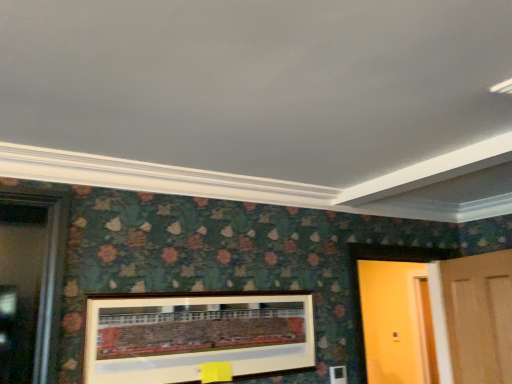
Image resolution: width=512 pixels, height=384 pixels. What do you see at coordinates (389, 261) in the screenshot?
I see `wooden door at right, the 2th door in the right-to-left sequence` at bounding box center [389, 261].

Describe the element at coordinates (196, 335) in the screenshot. I see `wooden picture frame at center` at that location.

At what (x,y) coordinates should I click in order to perform the action: click on wooden door at right, the 2th door in the right-to-left sequence. Please return your answer as a coordinate pair (x, y). The width and height of the screenshot is (512, 384). Looking at the image, I should click on (389, 261).

How many degrees apart are the facing directions of wooden door at right, which is the first door in right-to-left order, and wooden door at right, the 2th door in the right-to-left sequence?

wooden door at right, which is the first door in right-to-left order, and wooden door at right, the 2th door in the right-to-left sequence, are facing 110 degrees away from each other.

This screenshot has height=384, width=512. Find the location of `door in front of the wooden door at right, which is the first door in left-to-right order`. door in front of the wooden door at right, which is the first door in left-to-right order is located at coordinates (474, 317).

Who is taller, wooden door at right, the second door positioned from the left, or wooden door at right, which is the first door in left-to-right order?

wooden door at right, which is the first door in left-to-right order.

Which object is positioned more to the right, wooden door at right, which is the first door in right-to-left order, or wooden door at right, the 2th door in the right-to-left sequence?

wooden door at right, which is the first door in right-to-left order, is more to the right.

How much distance is there between wooden picture frame at center and wooden door at right, the 2th door in the right-to-left sequence?

The distance of wooden picture frame at center from wooden door at right, the 2th door in the right-to-left sequence, is 32.88 inches.

Is wooden picture frame at center positioned beyond the bounds of wooden door at right, which is the first door in left-to-right order?

wooden picture frame at center lies outside wooden door at right, which is the first door in left-to-right order,'s area.

Is wooden picture frame at center shorter than wooden door at right, the 2th door in the right-to-left sequence?

Yes.

From the picture: How different are the orientations of wooden door at right, which is the first door in left-to-right order, and wooden door at right, which is the first door in right-to-left order, in degrees?

The facing directions of wooden door at right, which is the first door in left-to-right order, and wooden door at right, which is the first door in right-to-left order, are 110 degrees apart.

Considering the positions of point (366, 258) and point (482, 345), is point (366, 258) closer or farther from the camera than point (482, 345)?

Clearly, point (366, 258) is more distant from the camera than point (482, 345).

Would you say wooden door at right, which is the first door in left-to-right order, is inside or outside wooden door at right, the second door positioned from the left?

wooden door at right, which is the first door in left-to-right order, lies outside wooden door at right, the second door positioned from the left.

From a real-world perspective, which is physically below, wooden door at right, which is the first door in left-to-right order, or wooden door at right, which is the first door in right-to-left order?

wooden door at right, which is the first door in right-to-left order, from a real-world perspective.

Considering the sizes of objects wooden door at right, which is the first door in right-to-left order, and wooden picture frame at center in the image provided, who is thinner, wooden door at right, which is the first door in right-to-left order, or wooden picture frame at center?

→ wooden picture frame at center.

What's the angular difference between wooden door at right, which is the first door in right-to-left order, and wooden picture frame at center's facing directions?

They differ by 110 degrees in their facing directions.

From a real-world perspective, who is located higher, wooden door at right, which is the first door in right-to-left order, or wooden picture frame at center?

From a 3D spatial view, wooden door at right, which is the first door in right-to-left order, is above.

Considering the positions of objects wooden door at right, the 2th door in the right-to-left sequence, and wooden picture frame at center in the image provided, who is behind, wooden door at right, the 2th door in the right-to-left sequence, or wooden picture frame at center?

wooden door at right, the 2th door in the right-to-left sequence, is further away from the camera.

Considering the positions of points (358, 335) and (151, 333), is point (358, 335) closer to camera compared to point (151, 333)?

No, it is not.

Do you think wooden door at right, the 2th door in the right-to-left sequence, is within wooden picture frame at center, or outside of it?

wooden door at right, the 2th door in the right-to-left sequence, lies outside wooden picture frame at center.

Based on the photo, from the image's perspective, which one is positioned lower, wooden door at right, which is the first door in left-to-right order, or wooden picture frame at center?

wooden door at right, which is the first door in left-to-right order, is shown below in the image.

Considering the relative sizes of wooden picture frame at center and wooden door at right, the second door positioned from the left, in the image provided, is wooden picture frame at center bigger than wooden door at right, the second door positioned from the left,?

Incorrect, wooden picture frame at center is not larger than wooden door at right, the second door positioned from the left.

Does wooden picture frame at center appear on the right side of wooden door at right, the second door positioned from the left?

In fact, wooden picture frame at center is to the left of wooden door at right, the second door positioned from the left.

Find the location of a particular element. The image size is (512, 384). picture frame in front of the wooden door at right, the second door positioned from the left is located at coordinates (196, 335).

This screenshot has width=512, height=384. I want to click on door behind the wooden door at right, which is the first door in right-to-left order, so pyautogui.click(x=389, y=261).

In order to click on picture frame below the wooden door at right, which is the first door in left-to-right order (from a real-world perspective) in this screenshot , I will do `click(196, 335)`.

From the image, which object appears to be nearer to wooden picture frame at center, wooden door at right, which is the first door in left-to-right order, or wooden door at right, the second door positioned from the left?

wooden door at right, which is the first door in left-to-right order, lies closer to wooden picture frame at center than the other object.

Considering their positions, is wooden door at right, the 2th door in the right-to-left sequence, positioned closer to wooden door at right, the second door positioned from the left, than wooden picture frame at center?

wooden door at right, the 2th door in the right-to-left sequence, lies closer to wooden door at right, the second door positioned from the left, than the other object.

Based on the photo, estimate the real-world distances between objects in this image. Which object is further from wooden door at right, the second door positioned from the left, wooden picture frame at center or wooden door at right, which is the first door in left-to-right order?

Among the two, wooden picture frame at center is located further to wooden door at right, the second door positioned from the left.

From the image, which object appears to be nearer to wooden door at right, the 2th door in the right-to-left sequence, wooden door at right, the second door positioned from the left, or wooden picture frame at center?

The object closer to wooden door at right, the 2th door in the right-to-left sequence, is wooden door at right, the second door positioned from the left.

Looking at the image, which one is located closer to wooden picture frame at center, wooden door at right, which is the first door in right-to-left order, or wooden door at right, which is the first door in left-to-right order?

Among the two, wooden door at right, which is the first door in left-to-right order, is located nearer to wooden picture frame at center.

From the image, which object appears to be nearer to wooden door at right, which is the first door in left-to-right order, wooden picture frame at center or wooden door at right, which is the first door in right-to-left order?

The object closer to wooden door at right, which is the first door in left-to-right order, is wooden door at right, which is the first door in right-to-left order.

What are the coordinates of `door between wooden picture frame at center and wooden door at right, the second door positioned from the left` in the screenshot? It's located at (389, 261).